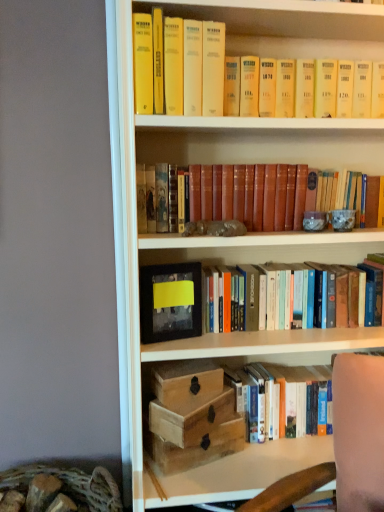
Locate an element on the screen. free location in front of wooden box at center is located at coordinates pyautogui.click(x=184, y=408).